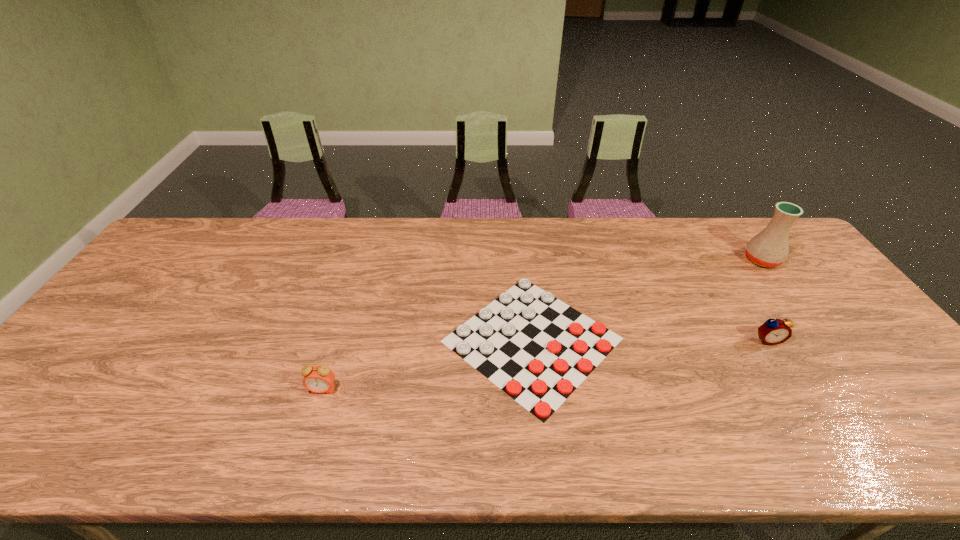
At what (x,y) coordinates should I click in order to perform the action: click on vacant space at the far right corner. Please return your answer as a coordinate pair (x, y). The width and height of the screenshot is (960, 540). Looking at the image, I should click on (764, 225).

Find the location of `vacant space in between the checkerboard and the farther alarm clock`. vacant space in between the checkerboard and the farther alarm clock is located at coordinates (650, 340).

You are a GUI agent. You are given a task and a screenshot of the screen. Output one action in this format:
    pyautogui.click(x=<x>, y=<y>)
    Task: Click on the free spot between the shortest object and the tallest object
    The width and height of the screenshot is (960, 540).
    Given the screenshot: What is the action you would take?
    pyautogui.click(x=647, y=300)

Where is `vacant region between the shortest object and the farther alarm clock`? Image resolution: width=960 pixels, height=540 pixels. vacant region between the shortest object and the farther alarm clock is located at coordinates (650, 340).

At what (x,y) coordinates should I click in order to perform the action: click on unoccupied area between the farthest object and the shortest object. Please return your answer as a coordinate pair (x, y). Image resolution: width=960 pixels, height=540 pixels. Looking at the image, I should click on coord(647,300).

Identify the location of vacant area that lies between the pottery and the right alarm clock. (765, 300).

Locate an element on the screen. The width and height of the screenshot is (960, 540). vacant space that's between the third object from right to left and the left alarm clock is located at coordinates (427, 364).

You are a GUI agent. You are given a task and a screenshot of the screen. Output one action in this format:
    pyautogui.click(x=<x>, y=<y>)
    Task: Click on the vacant space that is in between the shortest object and the leftmost object
    
    Given the screenshot: What is the action you would take?
    pyautogui.click(x=427, y=364)

You are a GUI agent. You are given a task and a screenshot of the screen. Output one action in this format:
    pyautogui.click(x=<x>, y=<y>)
    Task: Click on the vacant space that's between the right alarm clock and the farthest object
    Image resolution: width=960 pixels, height=540 pixels.
    Given the screenshot: What is the action you would take?
    pyautogui.click(x=765, y=300)

Identify the location of free space that is in between the checkerboard and the nearer alarm clock. (427, 364).